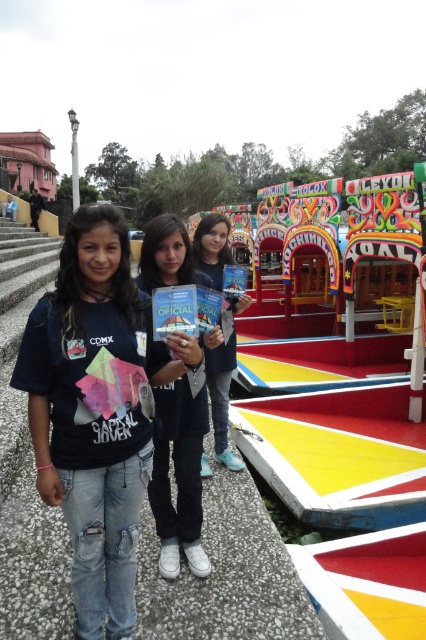
You are a photographer standing at the edge of the dock preparing to take a photo of the two people wearing the matte black jacket at center and the matte blue jeans at center. You need to ensure both subjects are in focus. Given that your camera has a depth of field that can cover objects within a 3 meter range, will both subjects be in focus?

The matte black jacket at center and the matte blue jeans at center are 2.94 meters apart from each other. Since the distance between them is within the 3 meter range of the camera, both subjects will be in focus.

You are a photographer trying to capture a clear shot of the denim jeans at center and the matte black jacket at center. From the perspective of the photographer, which object is positioned to the left?

The denim jeans at center is to the left of the matte black jacket at center, so the denim jeans at center is positioned to the left.